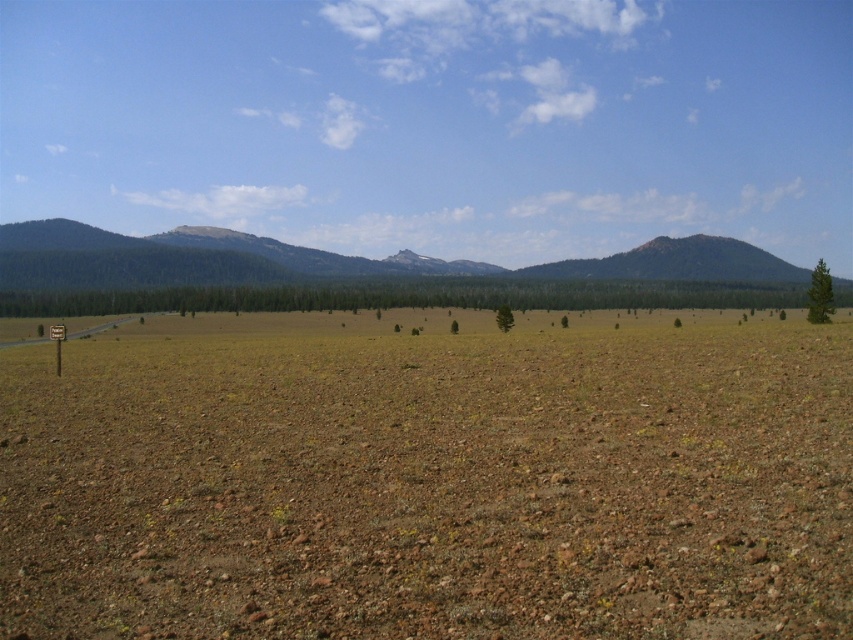
Between point (323, 417) and point (509, 328), which one is positioned in front?

Positioned in front is point (323, 417).

Does brown gravelly dirt field at center appear under green textured tree at center?

Correct, brown gravelly dirt field at center is located below green textured tree at center.

Find the location of a particular element. The width and height of the screenshot is (853, 640). brown gravelly dirt field at center is located at coordinates (428, 483).

Where is `brown gravelly dirt field at center`? This screenshot has width=853, height=640. brown gravelly dirt field at center is located at coordinates (428, 483).

Who is positioned more to the left, brown gravelly dirt field at center or green textured tree at right?

From the viewer's perspective, brown gravelly dirt field at center appears more on the left side.

Is point (445, 486) farther from viewer compared to point (827, 291)?

No.

Where is `brown gravelly dirt field at center`? Image resolution: width=853 pixels, height=640 pixels. brown gravelly dirt field at center is located at coordinates (428, 483).

Identify the location of brown gravelly dirt field at center. This screenshot has height=640, width=853. (428, 483).

Between point (811, 305) and point (503, 314), which one is positioned in front?

Point (811, 305) is more forward.

Does point (811, 285) lie behind point (514, 323)?

No, (811, 285) is in front of (514, 323).

Does point (811, 298) lie in front of point (506, 308)?

That is True.

Image resolution: width=853 pixels, height=640 pixels. I want to click on green textured tree at right, so click(820, 294).